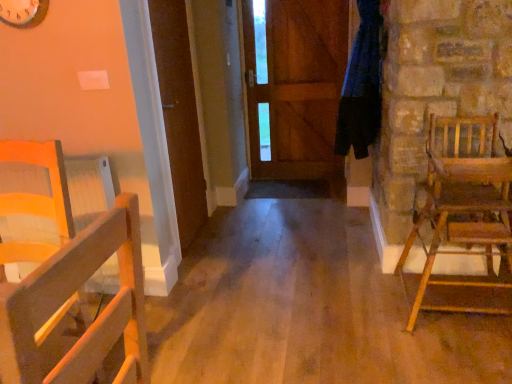
Where is `free region under wooden rocking chair at right, acting as the 2th chair starting from the left (from a real-world perspective)`? Image resolution: width=512 pixels, height=384 pixels. free region under wooden rocking chair at right, acting as the 2th chair starting from the left (from a real-world perspective) is located at coordinates (458, 314).